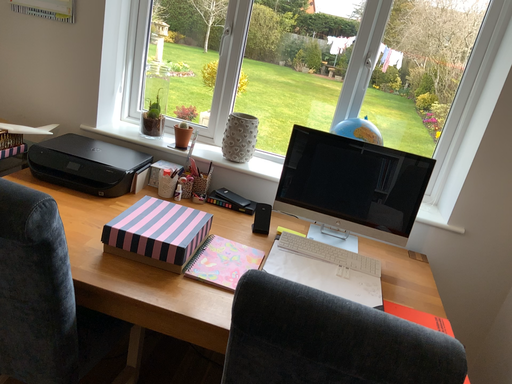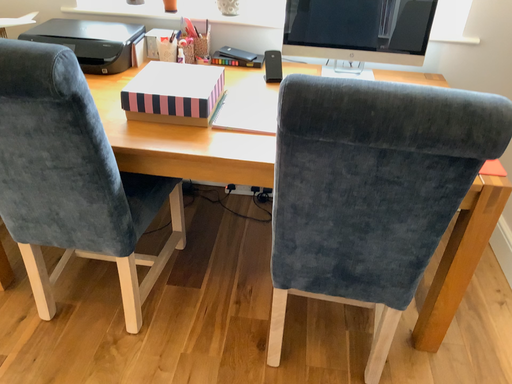
Question: Which way did the camera rotate in the video?

Choices:
 (A) rotated upward
 (B) rotated downward

Answer: (B)